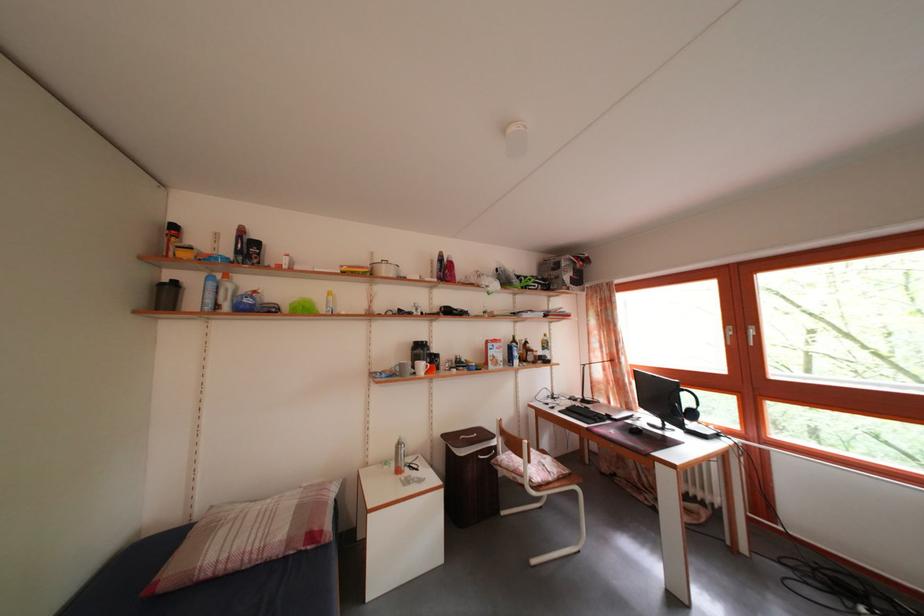
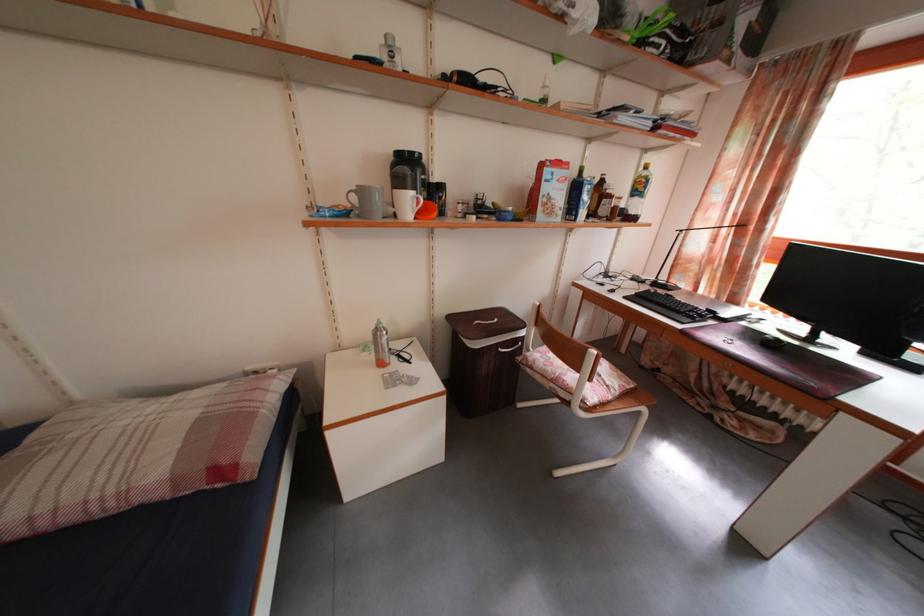
Where in the second image is the point corresponding to (x=420, y=378) from the first image?

(398, 217)